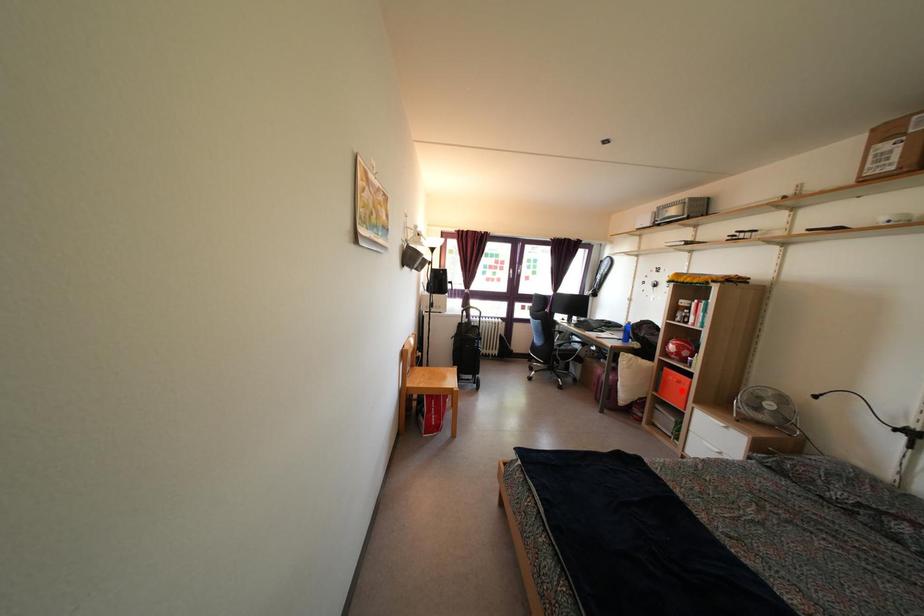
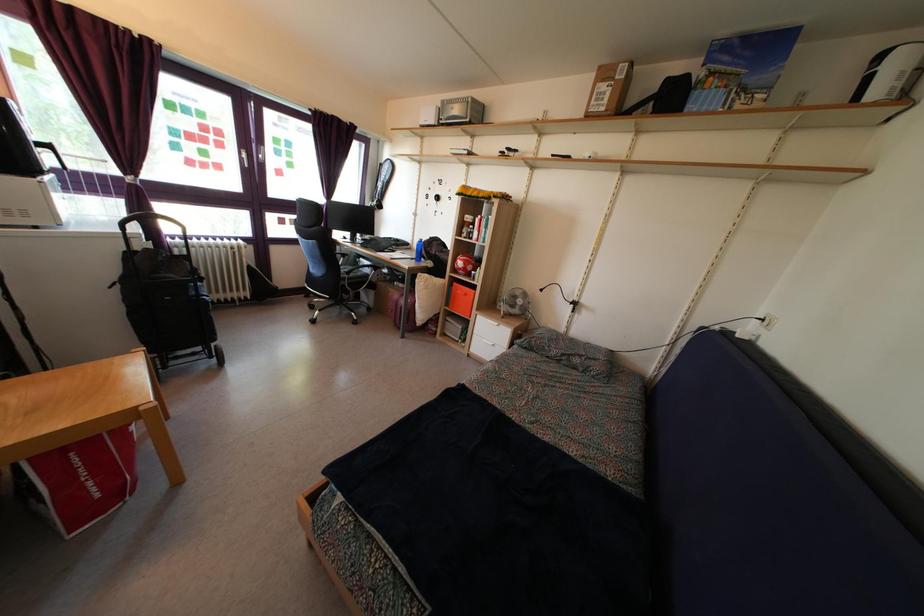
Locate, in the second image, the point that corresponds to the highlighted location in the first image.

(468, 302)